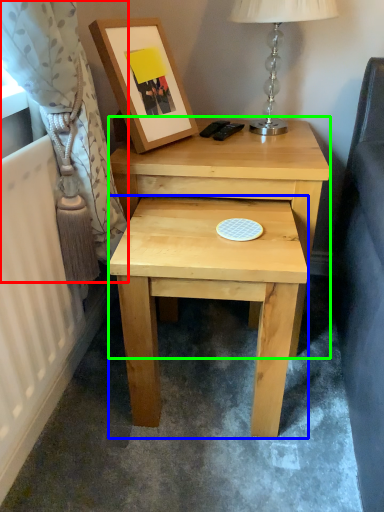
Question: Considering the real-world distances, which object is farthest from curtain (highlighted by a red box)? stool (highlighted by a blue box) or nightstand (highlighted by a green box)?

Choices:
 (A) stool
 (B) nightstand

Answer: (B)